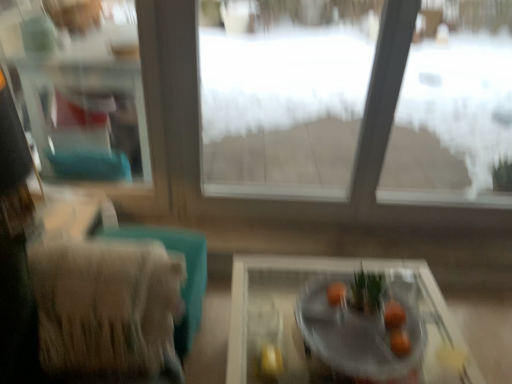
This screenshot has height=384, width=512. Find the location of `free space in front of smooth orange fruit at center`. free space in front of smooth orange fruit at center is located at coordinates (366, 358).